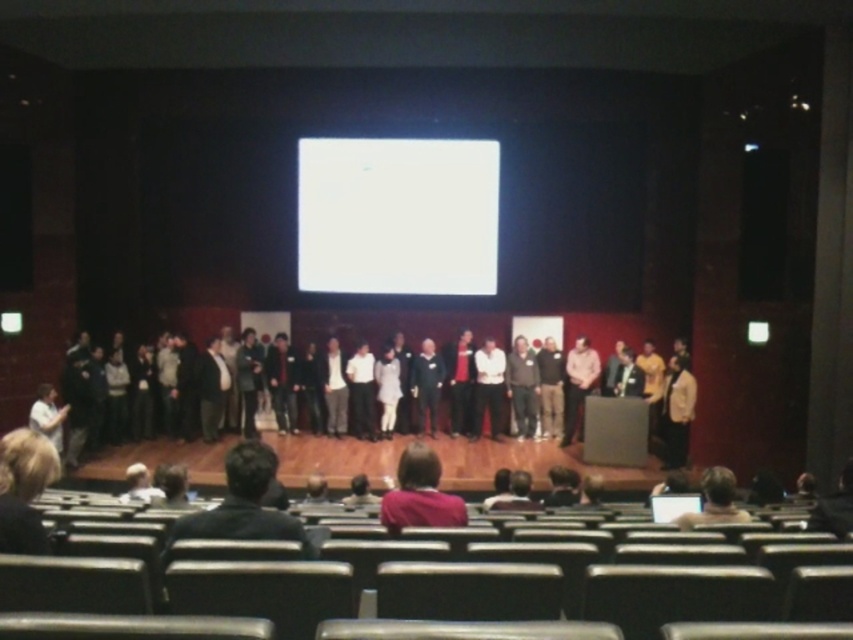
Question: Among these objects, which one is nearest to the camera?

Choices:
 (A) blonde hair at lower left
 (B) white glossy projection screen at center

Answer: (A)

Question: Does blonde hair at lower left have a smaller size compared to purple sweater at center?

Choices:
 (A) yes
 (B) no

Answer: (B)

Question: Is white glossy projection screen at center below blonde hair at lower left?

Choices:
 (A) no
 (B) yes

Answer: (A)

Question: Can you confirm if dark gray sweater at center is smaller than purple sweater at center?

Choices:
 (A) yes
 (B) no

Answer: (B)

Question: Which point is closer to the camera taking this photo?

Choices:
 (A) (431, 262)
 (B) (54, 456)

Answer: (B)

Question: Which point is farther from the camera taking this photo?

Choices:
 (A) (408, 141)
 (B) (9, 531)

Answer: (A)